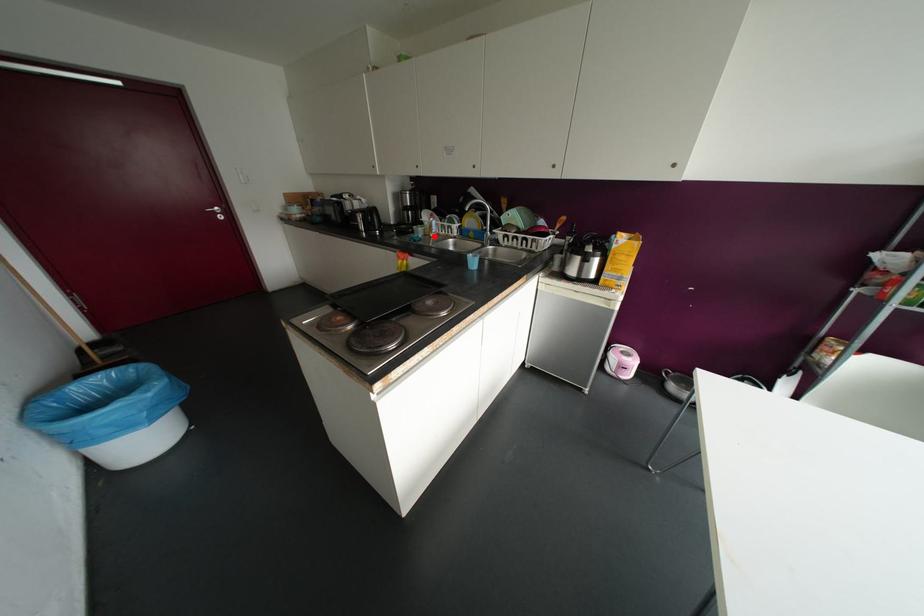
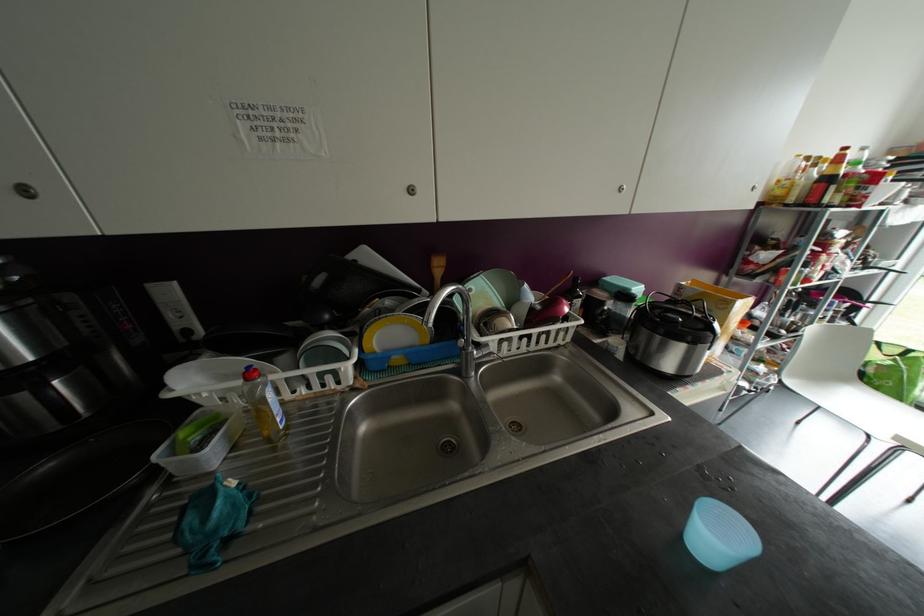
Locate, in the second image, the point that corresponds to the highlighted location in the first image.

(286, 427)